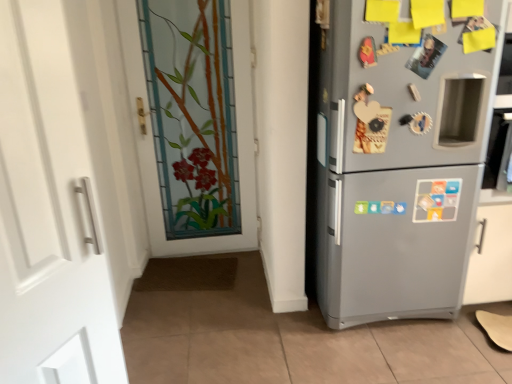
Question: Can you confirm if white matte door at left, the first door positioned from the front, is positioned to the right of satin silver fridge at right?

Choices:
 (A) no
 (B) yes

Answer: (A)

Question: Is white matte door at left, the 2th door from the back, completely or partially outside of satin silver fridge at right?

Choices:
 (A) no
 (B) yes

Answer: (B)

Question: Is the position of white matte door at left, which ranks as the 2th door in right-to-left order, more distant than that of satin silver fridge at right?

Choices:
 (A) yes
 (B) no

Answer: (B)

Question: Does white matte door at left, which ranks as the 2th door in right-to-left order, have a lesser height compared to satin silver fridge at right?

Choices:
 (A) yes
 (B) no

Answer: (A)

Question: From the image's perspective, is white matte door at left, the 2th door from the back, above satin silver fridge at right?

Choices:
 (A) yes
 (B) no

Answer: (B)

Question: Does point (142, 140) appear closer or farther from the camera than point (31, 347)?

Choices:
 (A) closer
 (B) farther

Answer: (B)

Question: Considering their positions, is stained glass door at center, the 2th door from the left, located in front of or behind white matte door at left, the 2th door from the back?

Choices:
 (A) behind
 (B) front

Answer: (A)

Question: In terms of width, does stained glass door at center, the 2th door from the left, look wider or thinner when compared to white matte door at left, placed as the first door when sorted from left to right?

Choices:
 (A) wide
 (B) thin

Answer: (A)

Question: Considering the relative positions of stained glass door at center, the 2th door from the left, and white matte door at left, which ranks as the 2th door in right-to-left order, in the image provided, is stained glass door at center, the 2th door from the left, to the left or to the right of white matte door at left, which ranks as the 2th door in right-to-left order,?

Choices:
 (A) left
 (B) right

Answer: (B)

Question: Is satin silver fridge at right to the left or to the right of white matte door at left, the 2th door from the back, in the image?

Choices:
 (A) left
 (B) right

Answer: (B)

Question: Considering their positions, is satin silver fridge at right located in front of or behind white matte door at left, which ranks as the 2th door in right-to-left order?

Choices:
 (A) behind
 (B) front

Answer: (A)

Question: From a real-world perspective, is satin silver fridge at right positioned above or below white matte door at left, the 2th door from the back?

Choices:
 (A) above
 (B) below

Answer: (B)

Question: Considering the positions of satin silver fridge at right and white matte door at left, placed as the first door when sorted from left to right, in the image, is satin silver fridge at right bigger or smaller than white matte door at left, placed as the first door when sorted from left to right,?

Choices:
 (A) big
 (B) small

Answer: (A)

Question: Considering the positions of white matte door at left, the 2th door from the back, and stained glass door at center, acting as the 2th door starting from the front, in the image, is white matte door at left, the 2th door from the back, taller or shorter than stained glass door at center, acting as the 2th door starting from the front,?

Choices:
 (A) short
 (B) tall

Answer: (A)

Question: In terms of size, does white matte door at left, which ranks as the 2th door in right-to-left order, appear bigger or smaller than stained glass door at center, which appears as the 1th door when viewed from the back?

Choices:
 (A) big
 (B) small

Answer: (B)